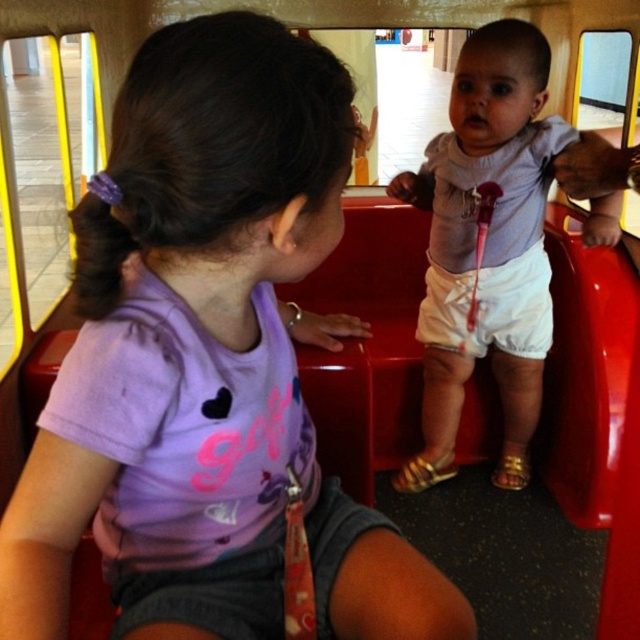
Question: Can you confirm if purple matte shirt at upper left is positioned to the left of white cotton shorts at center?

Choices:
 (A) yes
 (B) no

Answer: (A)

Question: Which object is farther from the camera taking this photo?

Choices:
 (A) purple matte shirt at upper left
 (B) white cotton shorts at center

Answer: (B)

Question: Does purple matte shirt at upper left have a lesser width compared to white cotton shorts at center?

Choices:
 (A) yes
 (B) no

Answer: (A)

Question: Is the position of purple matte shirt at upper left more distant than that of white cotton shorts at center?

Choices:
 (A) yes
 (B) no

Answer: (B)